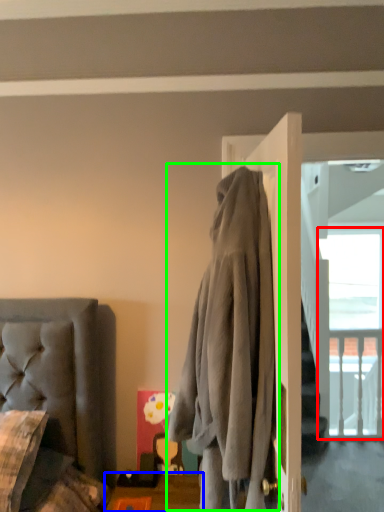
Question: Which is nearer to the window (highlighted by a red box)? table (highlighted by a blue box) or clothing (highlighted by a green box).

Choices:
 (A) table
 (B) clothing

Answer: (A)